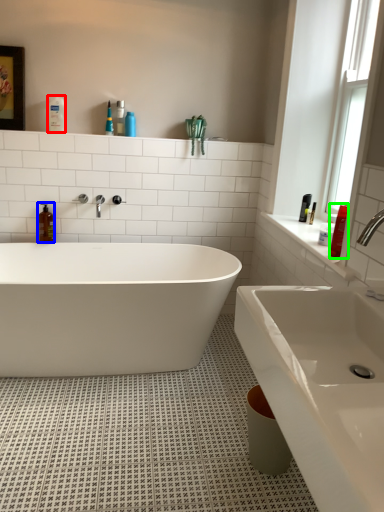
Question: Estimate the real-world distances between objects in this image. Which object is closer to toiletry (highlighted by a red box), soap dispenser (highlighted by a blue box) or toiletry (highlighted by a green box)?

Choices:
 (A) soap dispenser
 (B) toiletry

Answer: (A)